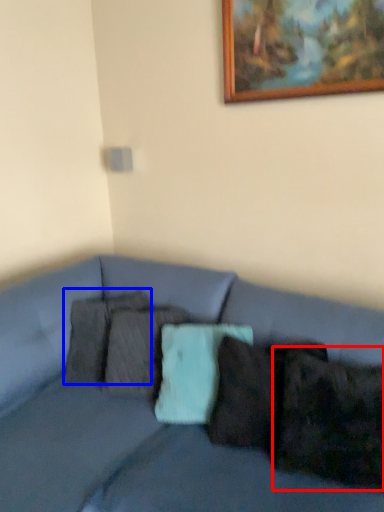
Question: Which object is closer to the camera taking this photo, pillow (highlighted by a red box) or pillow (highlighted by a blue box)?

Choices:
 (A) pillow
 (B) pillow

Answer: (A)